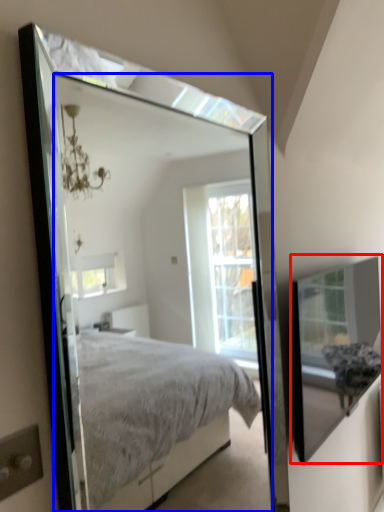
Question: Which object is further to the camera taking this photo, glass box (highlighted by a red box) or mirror (highlighted by a blue box)?

Choices:
 (A) glass box
 (B) mirror

Answer: (A)